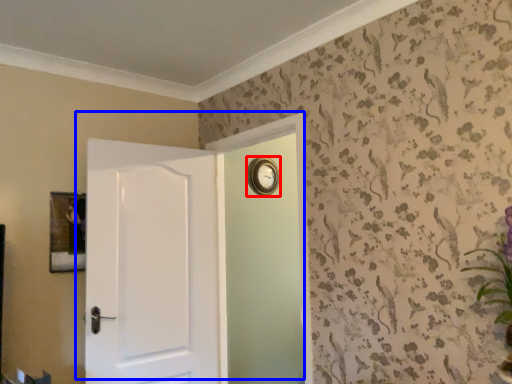
Question: Which of the following is the closest to the observer, clock (highlighted by a red box) or door (highlighted by a blue box)?

Choices:
 (A) clock
 (B) door

Answer: (B)